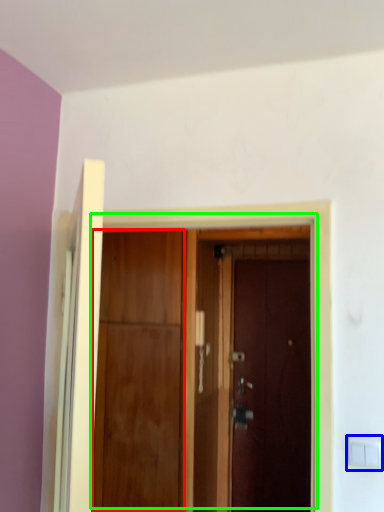
Question: Which is nearer to the door (highlighted by a red box)? light switch (highlighted by a blue box) or door (highlighted by a green box).

Choices:
 (A) light switch
 (B) door

Answer: (B)